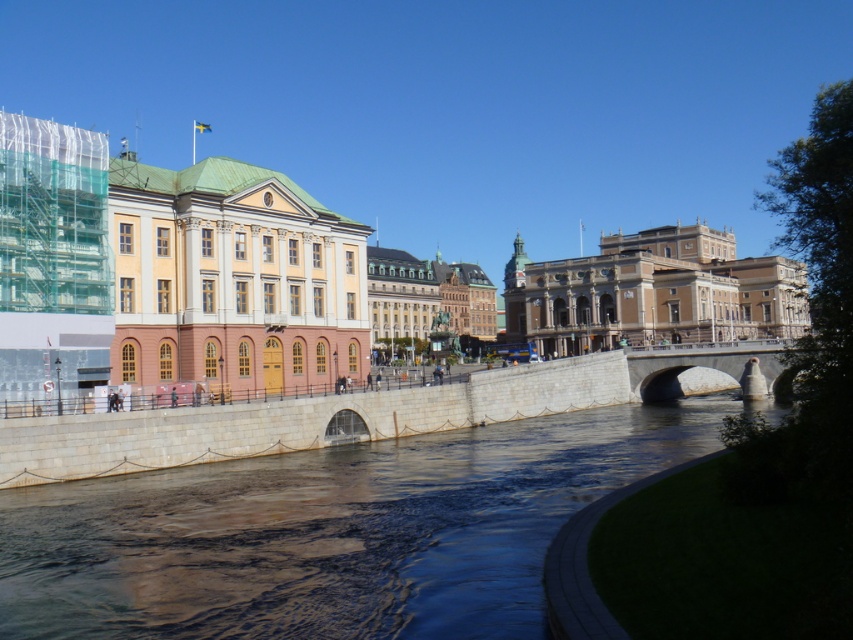
Is point (753, 280) behind point (669, 358)?

Yes, it is.

Which is more to the left, beige stone building at center or gray stone bridge at center?

gray stone bridge at center is more to the left.

Which is in front, point (593, 285) or point (692, 352)?

Point (692, 352) is in front.

Where is `beige stone building at center`? beige stone building at center is located at coordinates (653, 292).

Measure the distance between clear water at center and camera.

Result: A distance of 31.34 meters exists between clear water at center and camera.

Does clear water at center have a smaller size compared to matte yellow wood palace at center?

Yes.

Is point (102, 532) more distant than point (318, 340)?

No, it is not.

Image resolution: width=853 pixels, height=640 pixels. I want to click on clear water at center, so click(332, 532).

Is clear water at center further to the viewer compared to gray stone bridge at center?

No, it is in front of gray stone bridge at center.

Can you confirm if clear water at center is positioned below gray stone bridge at center?

Indeed, clear water at center is positioned under gray stone bridge at center.

Is point (39, 541) farther from camera compared to point (762, 388)?

That is False.

I want to click on clear water at center, so click(332, 532).